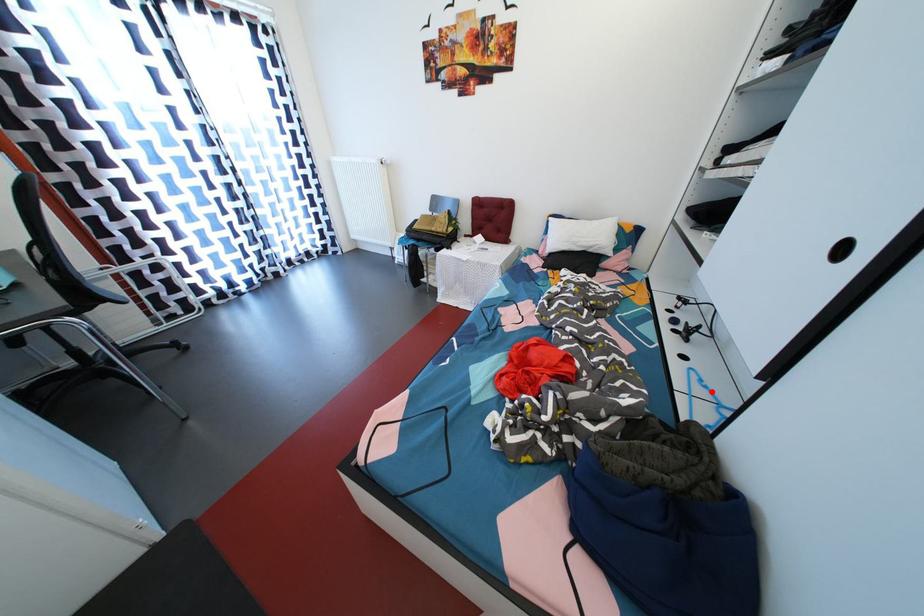
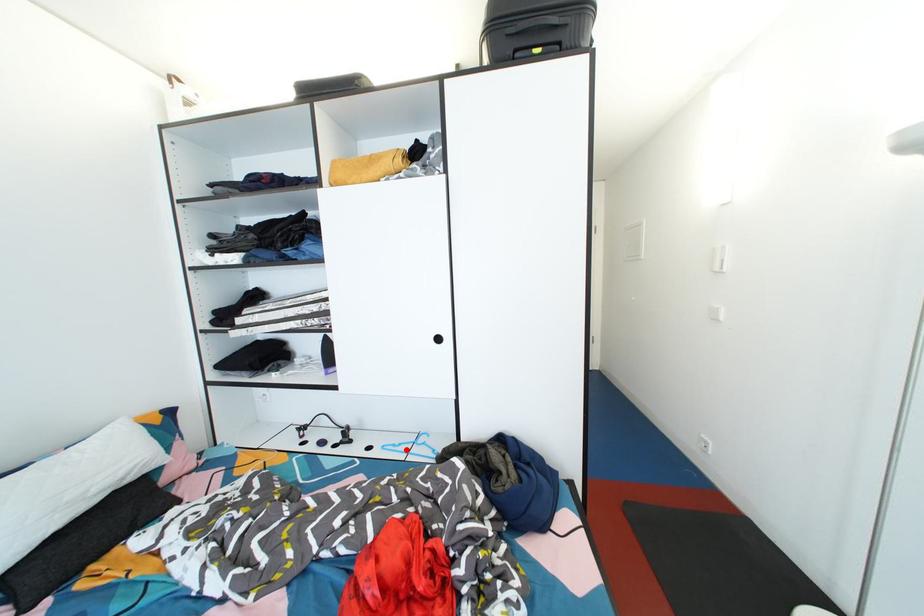
From the picture: I am providing you with two images of the same scene from different viewpoints. A red point is marked on the first image and another point is marked on the second image. Are the points marked in image1 and image2 representing the same 3D position?

Yes